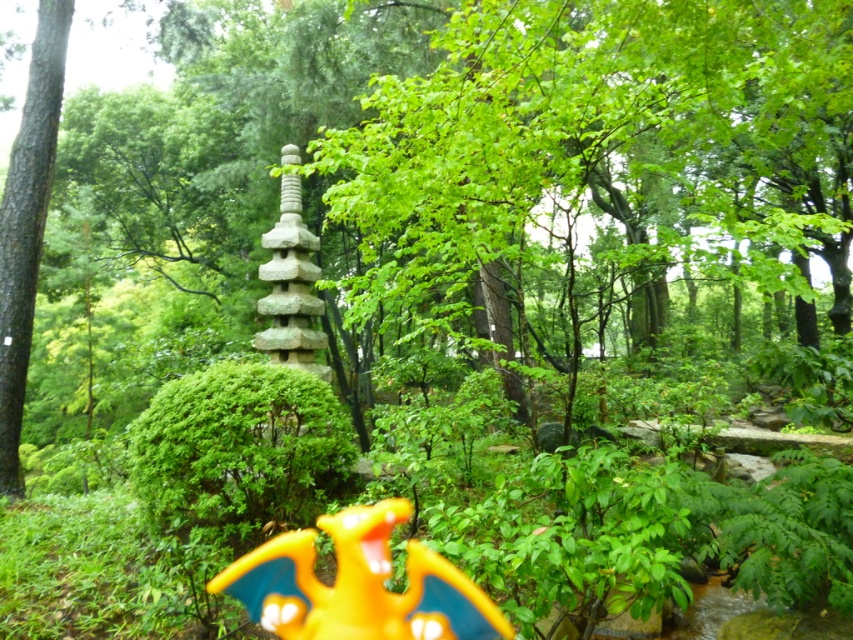
You are a photographer setting up a tripod to capture the yellow matte toy dragon at lower center and the green rough bark tree at left. You need to ensure that both subjects are fully visible in the frame. Based on their widths, which subject requires more horizontal space in the composition?

The yellow matte toy dragon at lower center might require more horizontal space in the composition since it might be wider than the green rough bark tree at left according to the description.